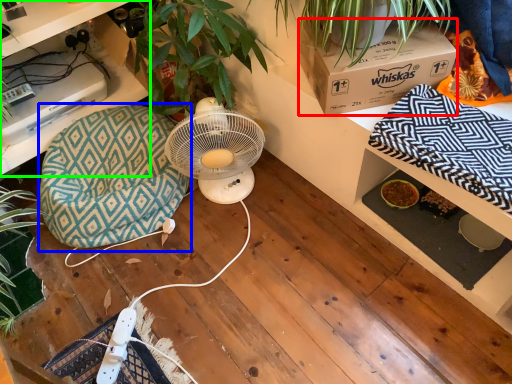
Question: Estimate the real-world distances between objects in this image. Which object is farther from box (highlighted by a red box), bean bag chair (highlighted by a blue box) or desk (highlighted by a green box)?

Choices:
 (A) bean bag chair
 (B) desk

Answer: (B)